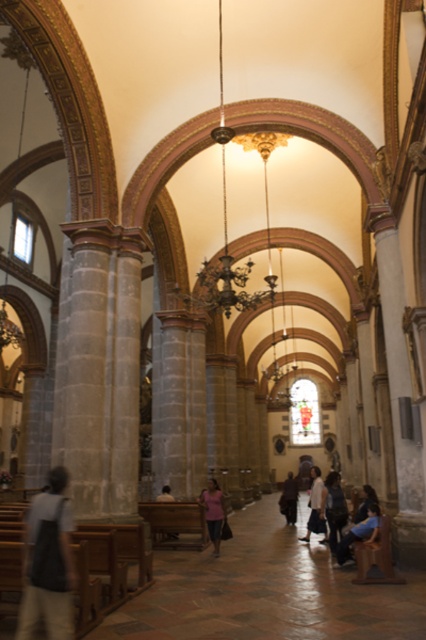
Can you confirm if dark brown leather jacket at center is bigger than dark blue shirt at lower right?

Correct, dark brown leather jacket at center is larger in size than dark blue shirt at lower right.

Is dark brown leather jacket at center shorter than dark blue shirt at lower right?

No, dark brown leather jacket at center is not shorter than dark blue shirt at lower right.

Which is in front, point (282, 506) or point (365, 509)?

Point (365, 509)

The image size is (426, 640). Find the location of `dark brown leather jacket at center`. dark brown leather jacket at center is located at coordinates (288, 499).

Does dark blue jeans at center have a smaller size compared to white cotton shirt at center?

Actually, dark blue jeans at center might be larger than white cotton shirt at center.

Is point (342, 500) in front of point (319, 520)?

Yes, it is.

Locate an element on the screen. The width and height of the screenshot is (426, 640). dark blue jeans at center is located at coordinates pos(333,508).

Between dark brown leather jacket at center and pink fabric at center, which one has more height?

With more height is dark brown leather jacket at center.

Is dark brown leather jacket at center thinner than pink fabric at center?

Incorrect, dark brown leather jacket at center's width is not less than pink fabric at center's.

Where is `dark brown leather jacket at center`? The width and height of the screenshot is (426, 640). dark brown leather jacket at center is located at coordinates (x=288, y=499).